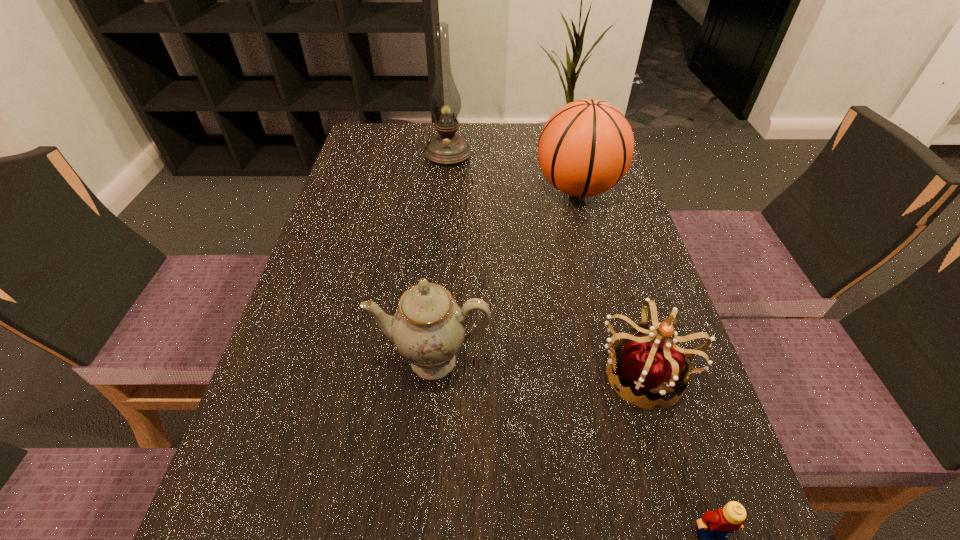
At what (x,y) coordinates should I click in order to perform the action: click on empty space between the tallest object and the basketball. Please return your answer as a coordinate pair (x, y). The image size is (960, 540). Looking at the image, I should click on (513, 171).

Identify the location of unoccupied area between the basketball and the chinaware. (505, 275).

This screenshot has width=960, height=540. Identify the location of free spot between the tiara and the oil lamp. (545, 263).

Find the location of `free point between the chinaware and the basketball`. free point between the chinaware and the basketball is located at coordinates (505, 275).

Point out which object is positioned as the second nearest to the basketball. Please provide its 2D coordinates. Your answer should be formatted as a tuple, i.e. [(x, y)], where the tuple contains the x and y coordinates of a point satisfying the conditions above.

[(653, 365)]

Select which object appears as the fourth closest to the nearest object. Please provide its 2D coordinates. Your answer should be formatted as a tuple, i.e. [(x, y)], where the tuple contains the x and y coordinates of a point satisfying the conditions above.

[(446, 149)]